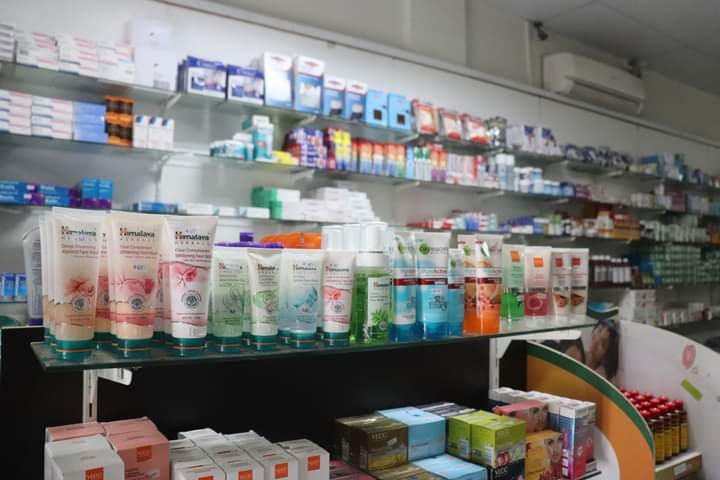
I want to click on boxes, so click(307, 90).